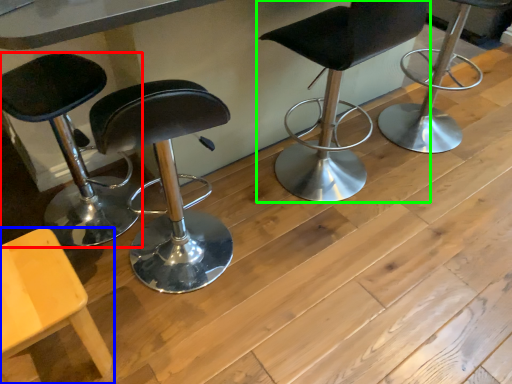
Question: Which object is positioned closest to chair (highlighted by a red box)? Select from chair (highlighted by a blue box) and chair (highlighted by a green box).

Choices:
 (A) chair
 (B) chair

Answer: (A)